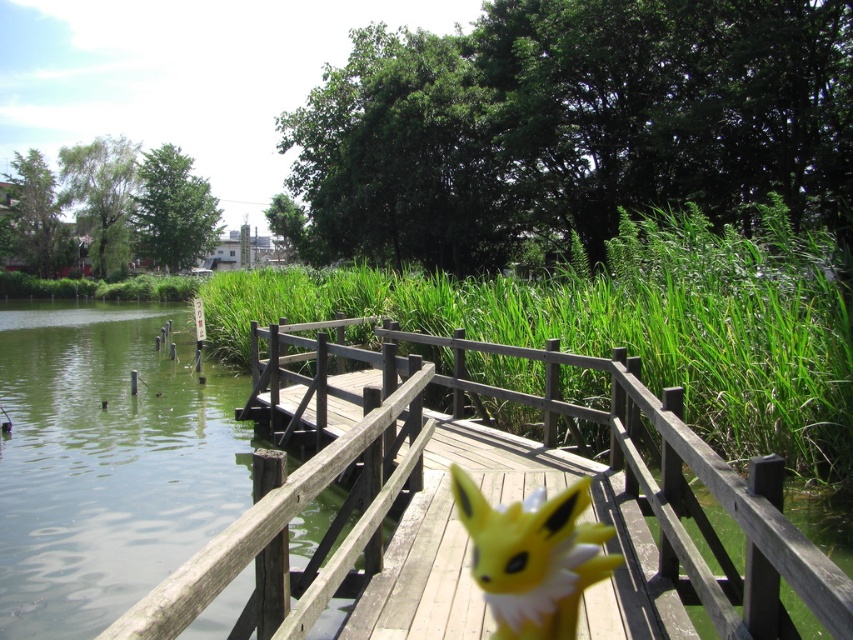
Is point (453, 570) in front of point (512, 577)?

No, it is not.

Is wooden bridge at center thinner than yellow plush toy at center?

Yes, wooden bridge at center is thinner than yellow plush toy at center.

Does point (270, 518) lie in front of point (566, 579)?

That is True.

I want to click on wooden bridge at center, so click(496, 496).